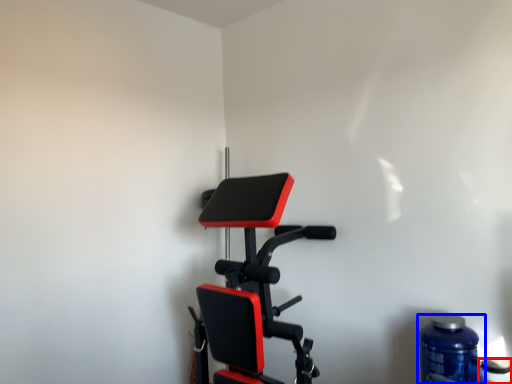
Question: Which point is closer to the camera, bottle (highlighted by a red box) or bottle (highlighted by a blue box)?

Choices:
 (A) bottle
 (B) bottle

Answer: (A)